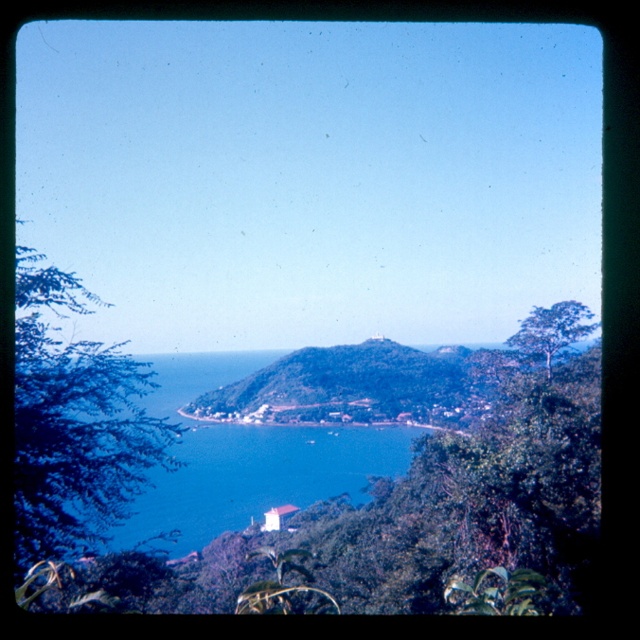
Question: Based on their relative distances, which object is farther from the green leafy tree at left?

Choices:
 (A) green leafy tree at upper right
 (B) green leafy hillside at center

Answer: (B)

Question: Observing the image, what is the correct spatial positioning of blue water at center in reference to green leafy hillside at center?

Choices:
 (A) above
 (B) below

Answer: (B)

Question: Which point is closer to the camera taking this photo?

Choices:
 (A) (339, 428)
 (B) (403, 358)
 (C) (58, 356)

Answer: (C)

Question: Which point is farther from the camera taking this photo?

Choices:
 (A) (129, 445)
 (B) (364, 433)
 (C) (538, 324)

Answer: (B)

Question: Is blue water at center bigger than green leafy tree at upper right?

Choices:
 (A) yes
 (B) no

Answer: (A)

Question: Where is green leafy hillside at center located in relation to green leafy tree at upper right in the image?

Choices:
 (A) below
 (B) above

Answer: (A)